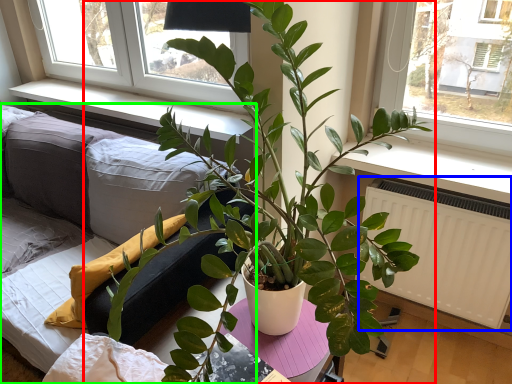
Question: Based on their relative distances, which object is farther from houseplant (highlighted by a red box)? Choose from radiator (highlighted by a blue box) and studio couch (highlighted by a green box).

Choices:
 (A) radiator
 (B) studio couch

Answer: (A)